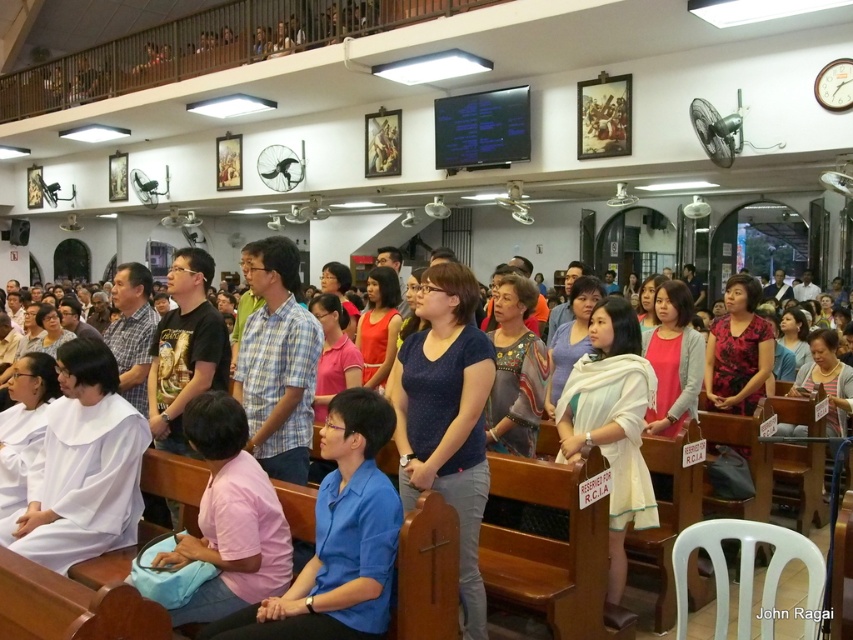
You are standing at the entrance of the church and notice two men wearing blue shirts. One is wearing a blue smooth shirt at lower center and the other a blue fabric shirt at center. Which man is closer to you?

The blue smooth shirt at lower center is closer to you because it is further to the viewer than the blue fabric shirt at center.

You are standing at the entrance of the church and see two points marked on the floor. One is at point (329, 419) and the other at point (9, 609). Which point is closer to the entrance?

Point (9, 609) is closer to the entrance because it is in front of point (329, 419).

You are a photographer standing at the back of the room. You want to take a photo that includes both the blue smooth shirt at lower center and the blue fabric shirt at center. Which shirt should you adjust your camera to focus on first to ensure both are in the frame?

The blue smooth shirt at lower center is positioned on the right side of the blue fabric shirt at center. Therefore, you should focus on the blue fabric shirt at center first, as it is to the left, and adjust your camera to include the blue smooth shirt at lower center on the right.